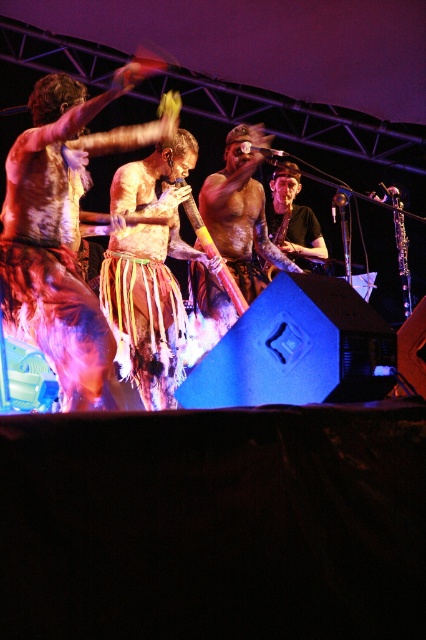
Based on the photo, is multicolored fabric skirt at center wider than multicolored fringed skirt at center?

Indeed, multicolored fabric skirt at center has a greater width compared to multicolored fringed skirt at center.

Who is taller, multicolored fabric skirt at center or multicolored fringed skirt at center?

multicolored fringed skirt at center is taller.

Locate an element on the screen. Image resolution: width=426 pixels, height=640 pixels. multicolored fabric skirt at center is located at coordinates (62, 230).

Does multicolored fabric skirt at center have a smaller size compared to shiny silver guitar at center?

Incorrect, multicolored fabric skirt at center is not smaller in size than shiny silver guitar at center.

Does multicolored fabric skirt at center have a larger size compared to shiny silver guitar at center?

Yes, multicolored fabric skirt at center is bigger than shiny silver guitar at center.

Does point (43, 291) come behind point (278, 243)?

No, (43, 291) is closer to viewer.

I want to click on multicolored fabric skirt at center, so [x=62, y=230].

Which is more to the right, multicolored fringed skirt at center or shiny silver guitar at center?

shiny silver guitar at center is more to the right.

Can you confirm if multicolored fringed skirt at center is positioned above shiny silver guitar at center?

No.

Does point (181, 154) come closer to viewer compared to point (276, 216)?

Yes, it is.

Find the location of a particular element. multicolored fringed skirt at center is located at coordinates (149, 273).